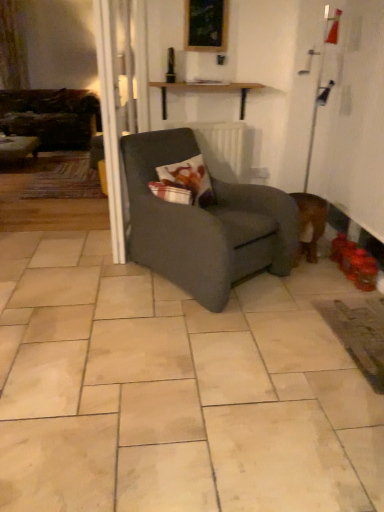
The height and width of the screenshot is (512, 384). I want to click on free point in front of dark gray fabric chair at center, so click(194, 344).